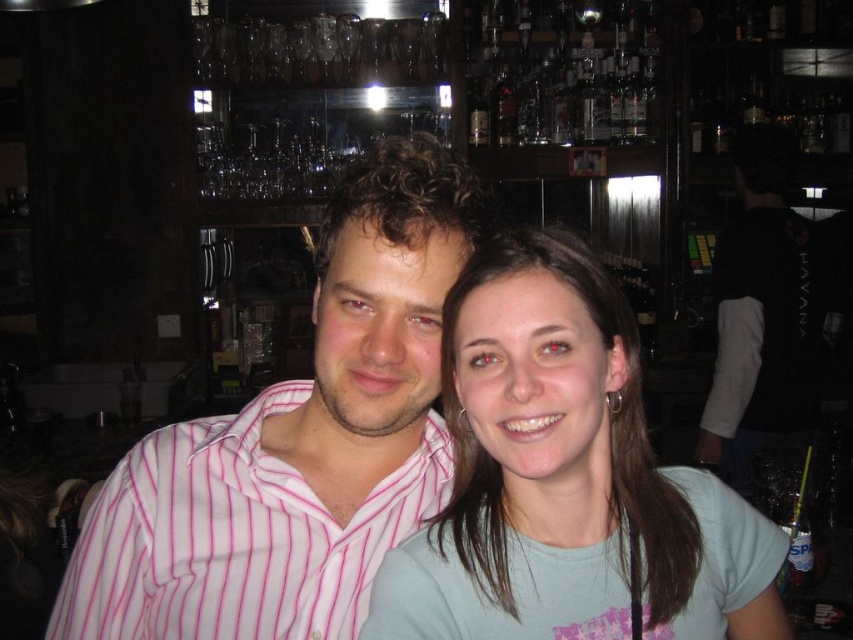
Which is above, pink striped shirt at center or light blue cotton shirt at center?

pink striped shirt at center

Between point (405, 228) and point (546, 504), which one is positioned in front?

Point (405, 228)

Does point (332, 410) lie behind point (726, 602)?

No, (332, 410) is closer to viewer.

This screenshot has height=640, width=853. In order to click on pink striped shirt at center in this screenshot , I will do `click(297, 442)`.

Describe the element at coordinates (564, 477) in the screenshot. I see `light blue cotton shirt at center` at that location.

Can you confirm if light blue cotton shirt at center is bigger than pink striped shirt at left?

Yes.

The height and width of the screenshot is (640, 853). In order to click on light blue cotton shirt at center in this screenshot , I will do `click(564, 477)`.

Is pink striped shirt at center wider than pink striped shirt at left?

Correct, the width of pink striped shirt at center exceeds that of pink striped shirt at left.

Is pink striped shirt at center smaller than pink striped shirt at left?

Actually, pink striped shirt at center might be larger than pink striped shirt at left.

Between point (392, 518) and point (242, 429), which one is positioned behind?

The point (392, 518) is more distant.

Locate an element on the screen. pink striped shirt at center is located at coordinates coord(297,442).